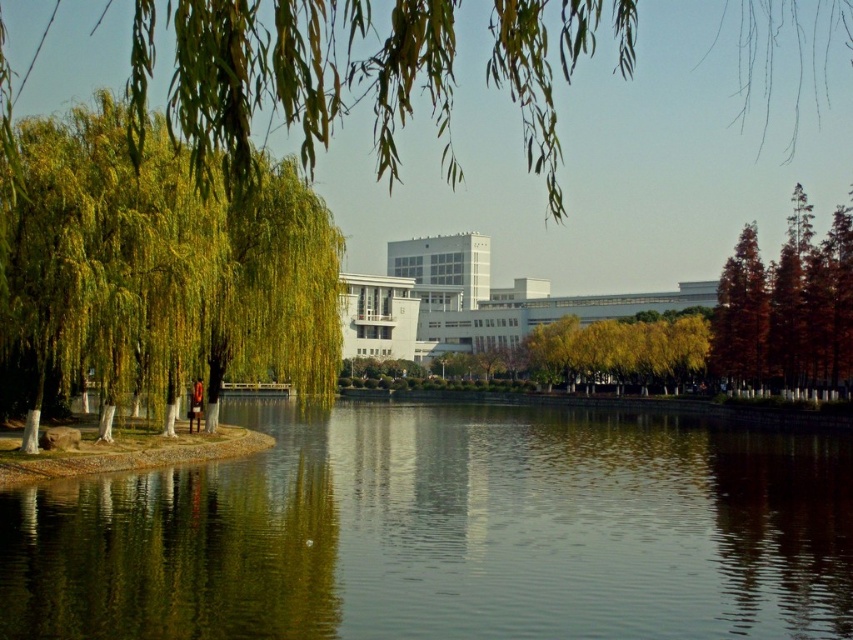
You are standing on the dock and see the green reflective water at center and the green leafy willow at left. Which object is positioned lower in the scene?

The green reflective water at center is located below the green leafy willow at left, so it is positioned lower in the scene.